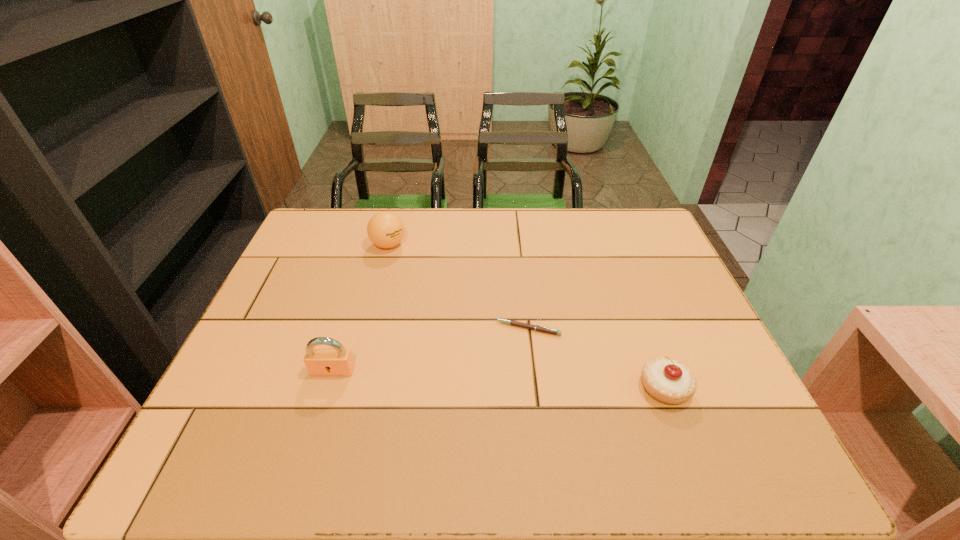
This screenshot has width=960, height=540. I want to click on vacant space at the left edge of the desktop, so click(309, 284).

Locate an element on the screen. vacant space at the right edge of the desktop is located at coordinates (669, 300).

Where is `free spot at the far left corner of the desktop`? free spot at the far left corner of the desktop is located at coordinates click(x=325, y=246).

Locate an element on the screen. blank area at the far right corner is located at coordinates (612, 221).

Image resolution: width=960 pixels, height=540 pixels. In the image, there is a desktop. In order to click on vacant space at the near right corner in this screenshot , I will do `click(678, 420)`.

This screenshot has width=960, height=540. I want to click on empty space between the rightmost object and the padlock, so click(x=498, y=380).

Locate an element on the screen. vacant space that's between the shortest object and the padlock is located at coordinates (430, 350).

Where is `free point between the pastry and the padlock`? free point between the pastry and the padlock is located at coordinates (498, 380).

Where is `vacant point located between the second object from right to left and the padlock`? vacant point located between the second object from right to left and the padlock is located at coordinates (430, 350).

Locate an element on the screen. Image resolution: width=960 pixels, height=540 pixels. free point between the padlock and the shortest object is located at coordinates (430, 350).